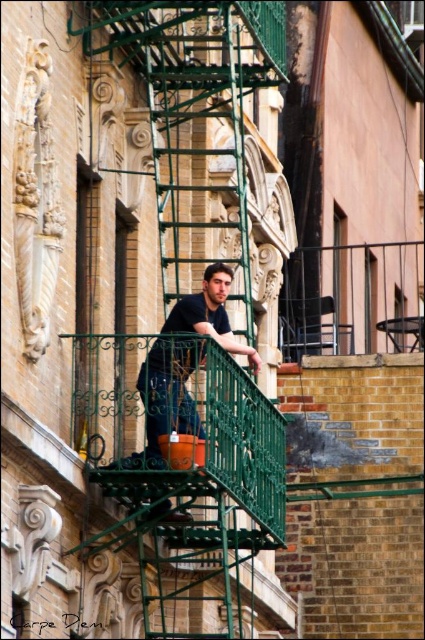
You are a delivery person trying to locate the correct apartment. You see the green metal fire escape at center and the dark blue shirt at center. Which object is closer to the building facade?

The dark blue shirt at center is closer to the building facade because the green metal fire escape at center is positioned on the right side of it, meaning the shirt is between the fire escape and the building.